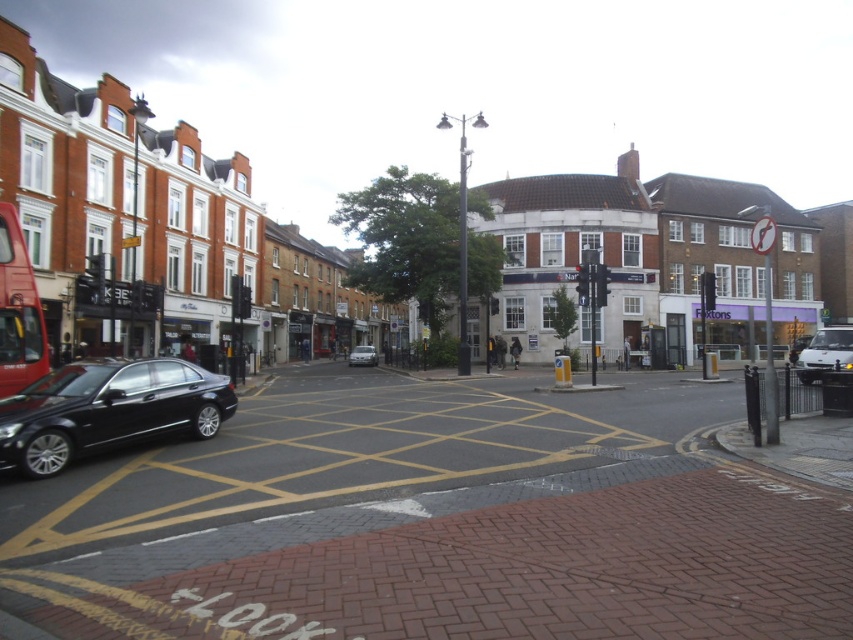
Which is more to the right, shiny black sedan at lower left or matte red bus at left?

shiny black sedan at lower left is more to the right.

Is shiny black sedan at lower left taller than matte red bus at left?

In fact, shiny black sedan at lower left may be shorter than matte red bus at left.

Who is more forward, (155, 374) or (19, 346)?

Point (155, 374) is in front.

The height and width of the screenshot is (640, 853). What are the coordinates of `shiny black sedan at lower left` in the screenshot? It's located at (107, 410).

Describe the element at coordinates (107, 410) in the screenshot. This screenshot has width=853, height=640. I see `shiny black sedan at lower left` at that location.

Is shiny black sedan at lower left positioned in front of silver metallic car at center?

Yes.

Between point (119, 429) and point (369, 358), which one is positioned in front?

Point (119, 429) is in front.

Locate an element on the screen. This screenshot has height=640, width=853. shiny black sedan at lower left is located at coordinates (107, 410).

Is matte red bus at left bigger than white matte van at right?

No, matte red bus at left is not bigger than white matte van at right.

Can you confirm if matte red bus at left is positioned below white matte van at right?

No, matte red bus at left is not below white matte van at right.

You are a GUI agent. You are given a task and a screenshot of the screen. Output one action in this format:
    pyautogui.click(x=<x>, y=<y>)
    Task: Click on the matte red bus at left
    
    Given the screenshot: What is the action you would take?
    pyautogui.click(x=18, y=310)